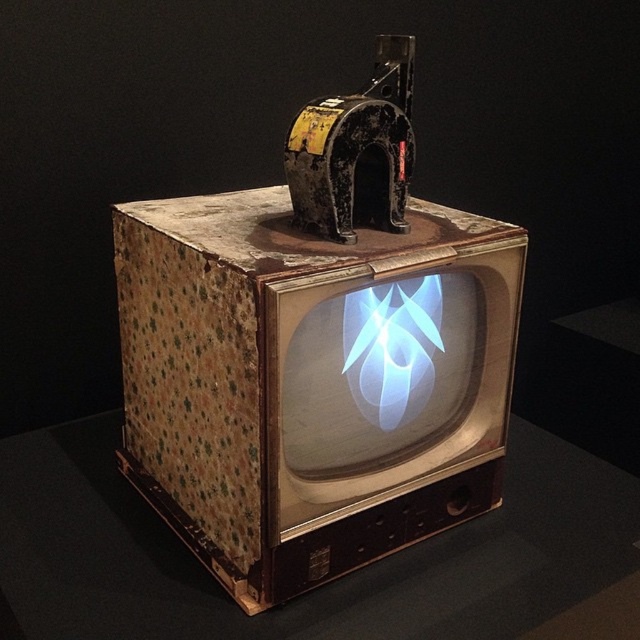
Question: Does rusty cardboard box at center have a smaller size compared to wooden table at center?

Choices:
 (A) yes
 (B) no

Answer: (B)

Question: Which point appears closest to the camera in this image?

Choices:
 (A) (316, 390)
 (B) (150, 563)

Answer: (A)

Question: Does rusty cardboard box at center lie in front of wooden table at center?

Choices:
 (A) yes
 (B) no

Answer: (A)

Question: Where is rusty cardboard box at center located in relation to wooden table at center in the image?

Choices:
 (A) above
 (B) below

Answer: (A)

Question: Which object appears farthest from the camera in this image?

Choices:
 (A) rusty cardboard box at center
 (B) wooden table at center

Answer: (B)